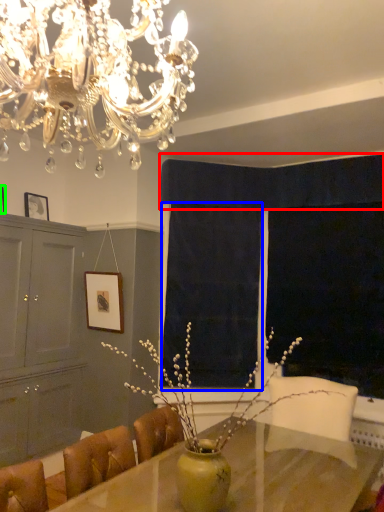
Question: Which object is positioned closest to curtain (highlighted by a red box)? Select from curtain (highlighted by a blue box) and picture frame (highlighted by a green box).

Choices:
 (A) curtain
 (B) picture frame

Answer: (A)